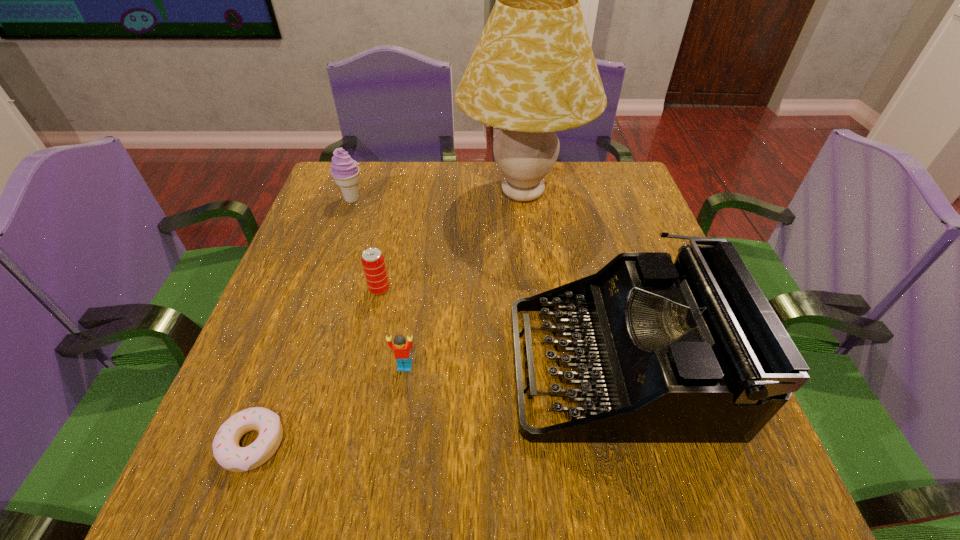
In the image, there is a desktop. At what (x,y) coordinates should I click in order to perform the action: click on vacant space at the near left corner. Please return your answer as a coordinate pair (x, y). This screenshot has height=540, width=960. Looking at the image, I should click on (189, 502).

You are a GUI agent. You are given a task and a screenshot of the screen. Output one action in this format:
    pyautogui.click(x=<x>, y=<y>)
    Task: Click on the free space at the far right corner of the desktop
    The width and height of the screenshot is (960, 540).
    Given the screenshot: What is the action you would take?
    pyautogui.click(x=588, y=192)

I want to click on free space at the near right corner of the desktop, so click(751, 497).

What are the coordinates of `free space between the tallest object and the third farthest object` in the screenshot? It's located at (451, 242).

Where is `vacant region between the soda can and the tallest object`? The height and width of the screenshot is (540, 960). vacant region between the soda can and the tallest object is located at coordinates (451, 242).

You are a GUI agent. You are given a task and a screenshot of the screen. Output one action in this format:
    pyautogui.click(x=<x>, y=<y>)
    Task: Click on the free space between the third farthest object and the third tallest object
    
    Given the screenshot: What is the action you would take?
    pyautogui.click(x=366, y=245)

Image resolution: width=960 pixels, height=540 pixels. I want to click on free area in between the fifth shortest object and the third farthest object, so click(498, 327).

In order to click on unoccupied position between the doughnut and the typewriter in this screenshot , I will do `click(435, 404)`.

Locate an element on the screen. free point between the fourth nearest object and the typewriter is located at coordinates (498, 327).

Locate an element on the screen. The width and height of the screenshot is (960, 540). vacant area that lies between the fifth shortest object and the tallest object is located at coordinates (569, 279).